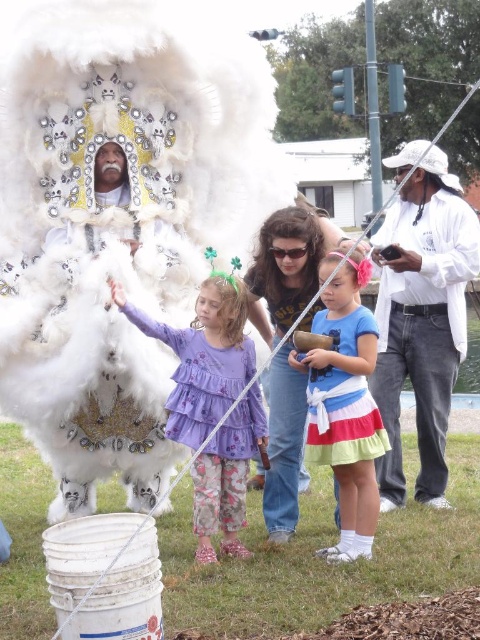
You are a photographer at the event and want to capture both the white fluffy costume at center and the denim jeans at center in a single shot. Which object should you focus on first to ensure both are in frame?

You should focus on the white fluffy costume at center first since it is closer to you than the denim jeans at center, ensuring both will be in frame when properly adjusted.